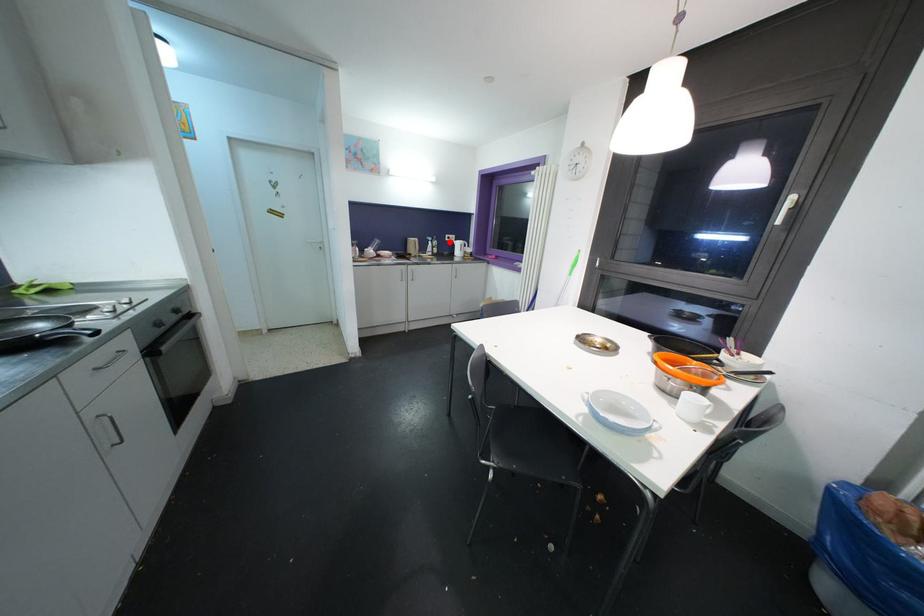
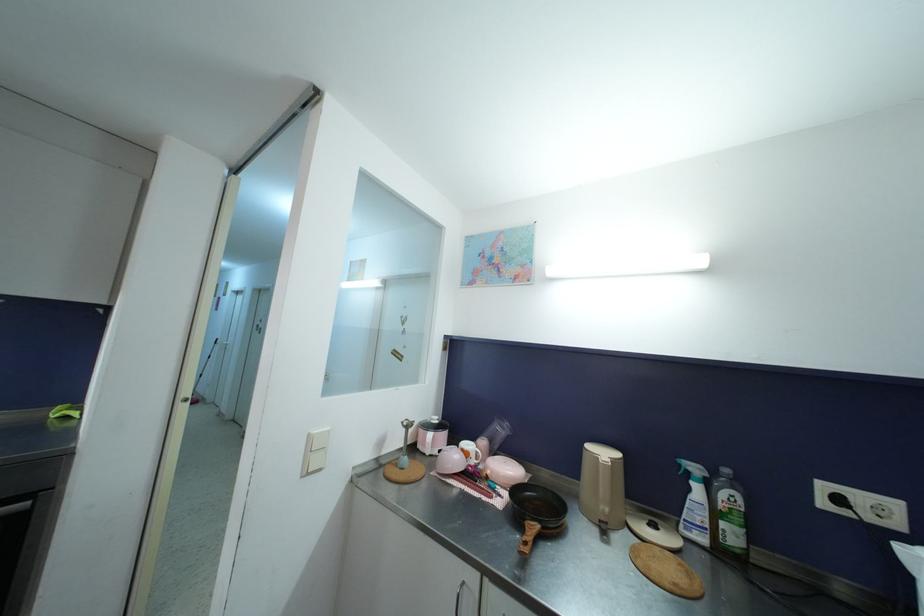
Question: I am providing you with two images of the same scene from different viewpoints. Image1 has a red point marked. In image2, the corresponding 3D location appears at what relative position? Reply with the corresponding letter.

Choices:
 (A) Closer
 (B) Farther

Answer: (B)